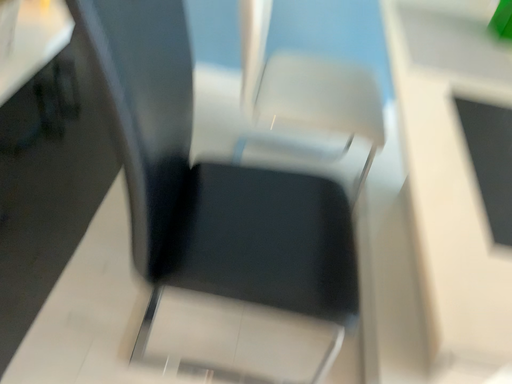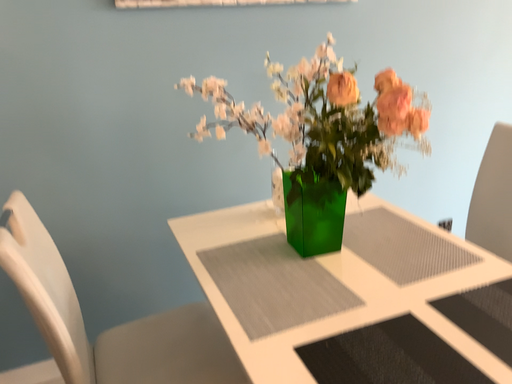
Question: How did the camera likely rotate when shooting the video?

Choices:
 (A) rotated upward
 (B) rotated downward

Answer: (A)